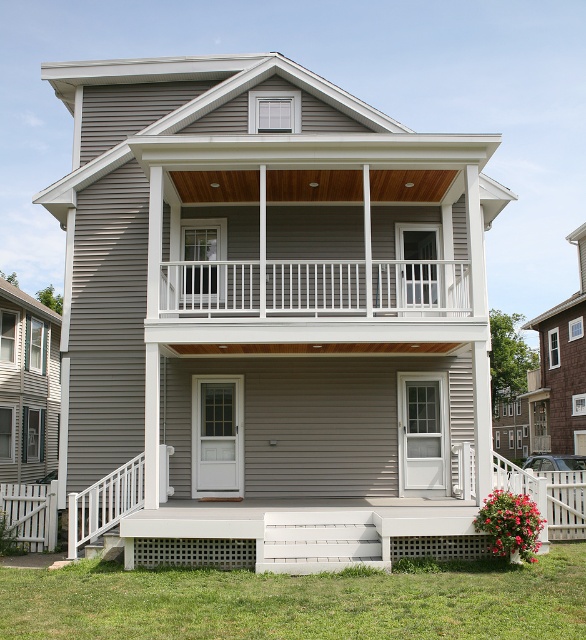
Question: Is white wooden railing at upper center in front of white plastic balustrade at lower left?

Choices:
 (A) no
 (B) yes

Answer: (A)

Question: Does white wooden railing at upper center have a larger size compared to white plastic balustrade at lower left?

Choices:
 (A) yes
 (B) no

Answer: (A)

Question: Which point is farther from the camera taking this photo?

Choices:
 (A) (311, 276)
 (B) (91, 506)

Answer: (A)

Question: Does white wooden railing at upper center lie behind white plastic balustrade at lower left?

Choices:
 (A) no
 (B) yes

Answer: (B)